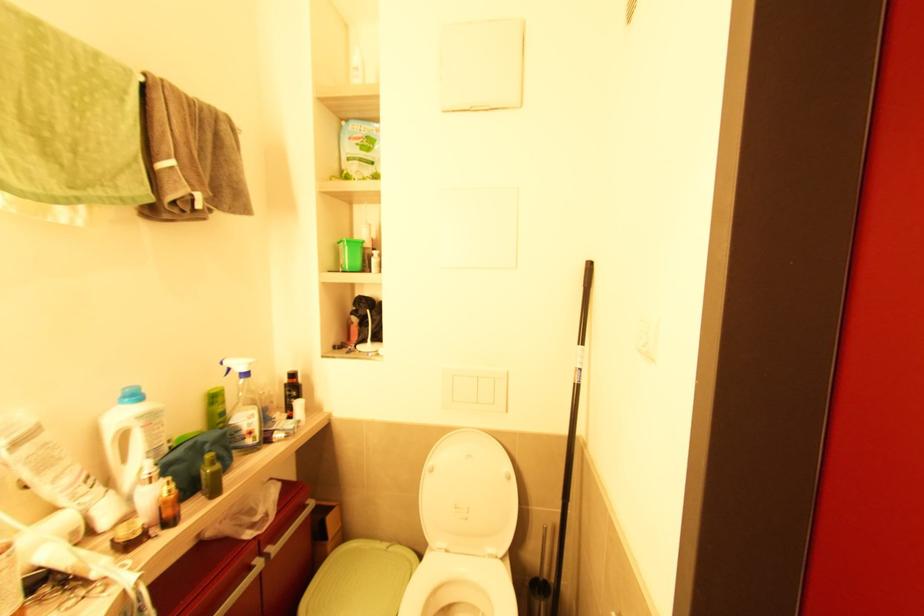
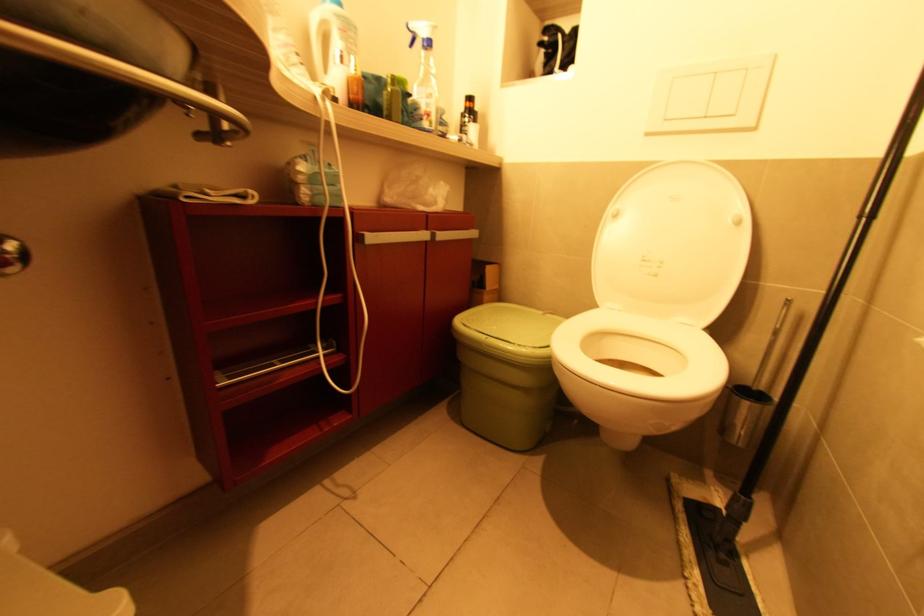
Question: I am providing you with two images of the same scene from different viewpoints. After the viewpoint changes to image2, which objects are now occluded?

Choices:
 (A) silver cabinet handle
 (B) toilet brush handle
 (C) white flush button
 (D) none of these

Answer: (D)